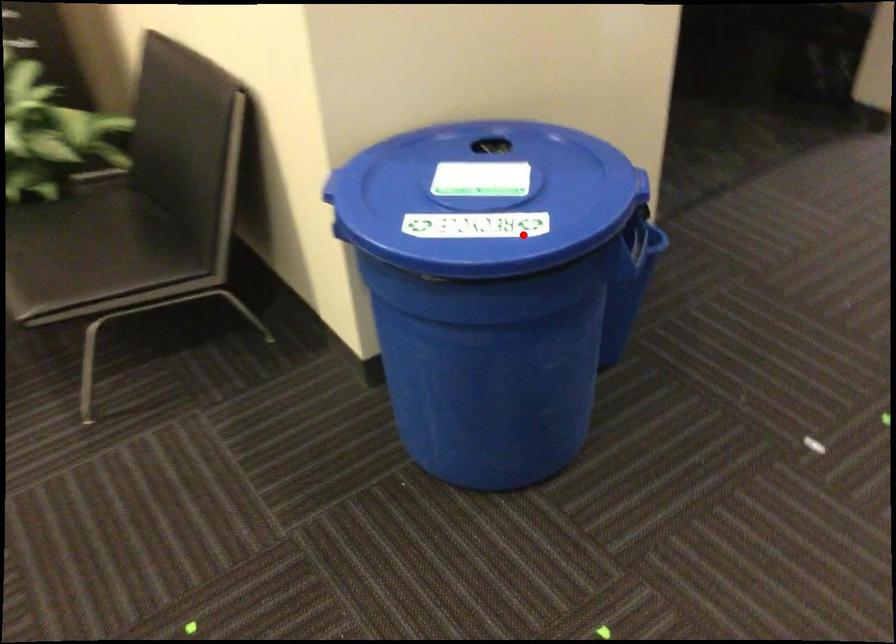
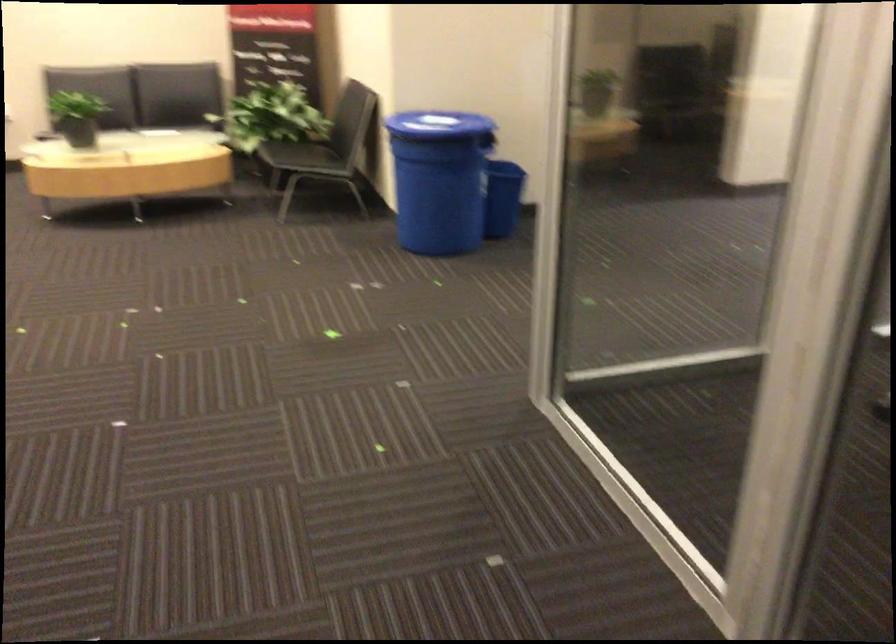
Question: I am providing you with two images of the same scene from different viewpoints. A red point is shown in image1. For the corresponding object point in image2, is it positioned nearer or farther from the camera?

Choices:
 (A) Nearer
 (B) Farther

Answer: (B)